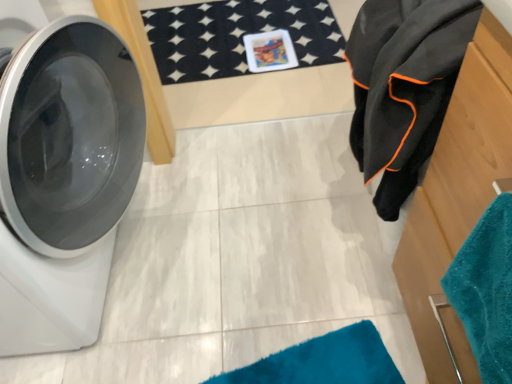
What do you see at coordinates (64, 180) in the screenshot?
I see `white glossy washing machine at left` at bounding box center [64, 180].

Describe the element at coordinates (457, 198) in the screenshot. The image size is (512, 384). I see `wooden dresser at right` at that location.

The height and width of the screenshot is (384, 512). What do you see at coordinates (486, 290) in the screenshot?
I see `teal soft towel at right` at bounding box center [486, 290].

Where is `white glossy washing machine at left`? white glossy washing machine at left is located at coordinates (64, 180).

Visually, is wooden dresser at right positioned to the left or to the right of black fleece towel at right?

In the image, wooden dresser at right appears on the right side of black fleece towel at right.

Is black fleece towel at right inside wooden dresser at right?

Definitely not — black fleece towel at right is not inside wooden dresser at right.

Does wooden dresser at right have a greater height compared to black fleece towel at right?

Yes.

From a real-world perspective, which is physically below, wooden dresser at right or black fleece towel at right?

In real-world perspective, wooden dresser at right is lower.

Can you confirm if white glossy washing machine at left is smaller than black fleece towel at right?

Actually, white glossy washing machine at left might be larger than black fleece towel at right.

Is white glossy washing machine at left not inside black fleece towel at right?

Yes, white glossy washing machine at left is not within black fleece towel at right.

Which is more to the left, white glossy washing machine at left or black fleece towel at right?

white glossy washing machine at left.

Consider the image. Which is in front, white glossy washing machine at left or black fleece towel at right?

white glossy washing machine at left.

Which is in front, wooden dresser at right or teal soft towel at right?

teal soft towel at right is more forward.

Is wooden dresser at right to the right of teal soft towel at right from the viewer's perspective?

Yes, wooden dresser at right is to the right of teal soft towel at right.

At what (x,y) coordinates should I click in order to perform the action: click on beach towel below the wooden dresser at right (from the image's perspective). Please return your answer as a coordinate pair (x, y). Image resolution: width=512 pixels, height=384 pixels. Looking at the image, I should click on (486, 290).

Is point (496, 79) positioned in front of point (475, 271)?

That is True.

Is teal soft towel at right in contact with black fleece towel at right?

No, teal soft towel at right is not next to black fleece towel at right.

Looking at this image, does teal soft towel at right have a larger size compared to black fleece towel at right?

Actually, teal soft towel at right might be smaller than black fleece towel at right.

Between teal soft towel at right and black fleece towel at right, which one has smaller width?

teal soft towel at right.

Is white glossy washing machine at left next to wooden dresser at right?

There is a gap between white glossy washing machine at left and wooden dresser at right.

Could you tell me if white glossy washing machine at left is turned towards wooden dresser at right?

Yes.

Which is more to the right, white glossy washing machine at left or wooden dresser at right?

wooden dresser at right is more to the right.

Image resolution: width=512 pixels, height=384 pixels. Identify the location of bath towel that is on the left side of wooden dresser at right. (404, 86).

From the image's perspective, is black fleece towel at right on wooden dresser at right?

Yes.

Is black fleece towel at right turned away from wooden dresser at right?

black fleece towel at right does not have its back to wooden dresser at right.

Which is more to the left, black fleece towel at right or wooden dresser at right?

black fleece towel at right.

Considering the sizes of objects wooden dresser at right and white glossy washing machine at left in the image provided, who is thinner, wooden dresser at right or white glossy washing machine at left?

Thinner between the two is wooden dresser at right.

Who is more distant, wooden dresser at right or white glossy washing machine at left?

white glossy washing machine at left is further away from the camera.

Could white glossy washing machine at left be considered to be inside wooden dresser at right?

No, wooden dresser at right does not contain white glossy washing machine at left.

Can you tell me how much wooden dresser at right and white glossy washing machine at left differ in facing direction?

They differ by 180 degrees in their facing directions.

Image resolution: width=512 pixels, height=384 pixels. What are the coordinates of `bath towel above the wooden dresser at right (from the image's perspective)` in the screenshot? It's located at (404, 86).

You are a GUI agent. You are given a task and a screenshot of the screen. Output one action in this format:
    pyautogui.click(x=<x>, y=<y>)
    Task: Click on the washing machine in front of the black fleece towel at right
    
    Given the screenshot: What is the action you would take?
    pyautogui.click(x=64, y=180)

Based on the photo, considering their positions, is teal soft towel at right positioned further to black fleece towel at right than wooden dresser at right?

teal soft towel at right is further to black fleece towel at right.

From the image, which object appears to be nearer to white glossy washing machine at left, black fleece towel at right or wooden dresser at right?

black fleece towel at right.

Consider the image. When comparing their distances from wooden dresser at right, does teal soft towel at right or black fleece towel at right seem further?

Based on the image, teal soft towel at right appears to be further to wooden dresser at right.

Looking at the image, which one is located further to teal soft towel at right, wooden dresser at right or black fleece towel at right?

black fleece towel at right lies further to teal soft towel at right than the other object.

Based on their spatial positions, is black fleece towel at right or teal soft towel at right closer to white glossy washing machine at left?

black fleece towel at right is positioned closer to the anchor white glossy washing machine at left.

Which object lies nearer to the anchor point white glossy washing machine at left, teal soft towel at right or wooden dresser at right?

Among the two, wooden dresser at right is located nearer to white glossy washing machine at left.

Which object lies further to the anchor point black fleece towel at right, white glossy washing machine at left or wooden dresser at right?

white glossy washing machine at left is further to black fleece towel at right.

When comparing their distances from wooden dresser at right, does black fleece towel at right or white glossy washing machine at left seem closer?

black fleece towel at right.

Find the location of a particular element. The image size is (512, 384). bath towel between white glossy washing machine at left and wooden dresser at right is located at coordinates (404, 86).

Find the location of a particular element. beach towel between white glossy washing machine at left and wooden dresser at right is located at coordinates (486, 290).

I want to click on dresser that lies between black fleece towel at right and teal soft towel at right from top to bottom, so click(x=457, y=198).

You are a GUI agent. You are given a task and a screenshot of the screen. Output one action in this format:
    pyautogui.click(x=<x>, y=<y>)
    Task: Click on the beach towel between white glossy washing machine at left and black fleece towel at right
    The width and height of the screenshot is (512, 384).
    Given the screenshot: What is the action you would take?
    pyautogui.click(x=486, y=290)